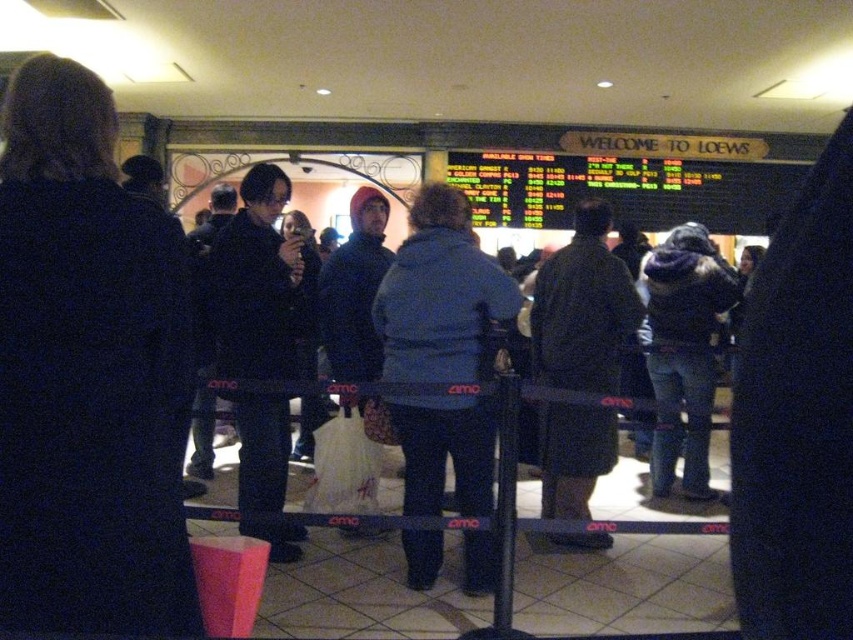
You are standing in the Loews movie theater lobby and notice two people in the queue wearing coats. Which one is wearing the dark blue coat at center on the left side of the blue fleece jacket at center?

The dark blue coat at center is positioned on the left side of the blue fleece jacket at center.

You are a theater employee who needs to hang a large poster on the wall behind the ticket counter. The poster requires at least 2 meters of space to fit properly. You see the dark blue coat at center and the blue fleece jacket at center in the queue. Which of the two items is more likely to block the space needed for the poster if they remain in the queue?

The blue fleece jacket at center is larger than the dark blue coat at center, so it is more likely to block the space needed for the poster if they remain in the queue.

You are standing at point [547,438] in the Loews theater lobby and want to walk to the ticket counter. There is a queue of people at point [405,573]. Which direction should you move to reach the ticket counter without going through the queue?

You should move behind point [405,573] since it is in front of you, so going around behind it would allow you to reach the ticket counter without interrupting the queue.